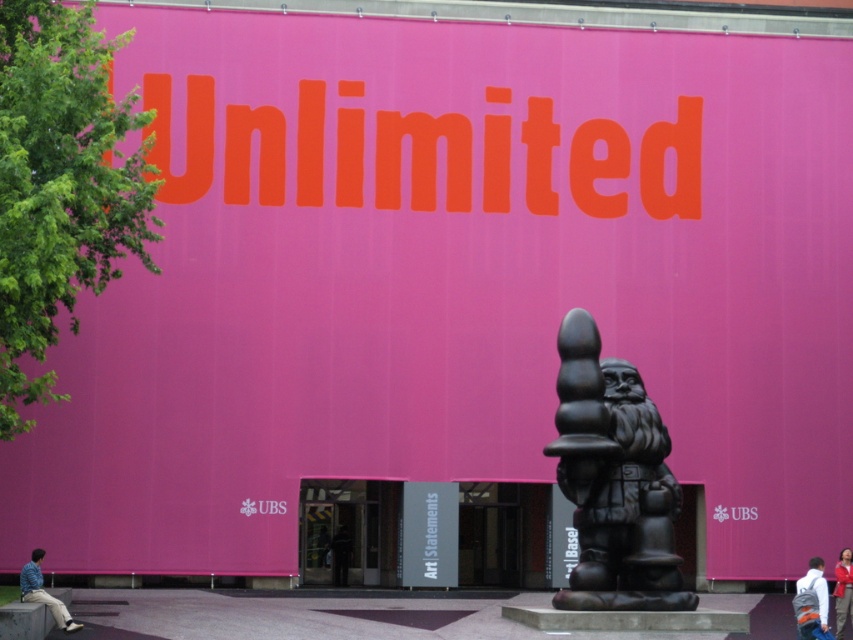
Question: Is black matte statue at center to the right of white fabric backpack at lower right from the viewer's perspective?

Choices:
 (A) yes
 (B) no

Answer: (B)

Question: Which of the following is the closest to the observer?

Choices:
 (A) (845, 556)
 (B) (47, 595)
 (C) (817, 566)

Answer: (C)

Question: Can you confirm if white fabric backpack at lower right is positioned below blue striped shirt at lower left?

Choices:
 (A) no
 (B) yes

Answer: (B)

Question: Which of the following is the farthest from the observer?

Choices:
 (A) (844, 547)
 (B) (631, 545)

Answer: (A)

Question: Which point is farther to the camera?

Choices:
 (A) (650, 506)
 (B) (834, 568)
 (C) (54, 596)

Answer: (C)

Question: Does white fabric backpack at lower right come in front of blue striped shirt at lower left?

Choices:
 (A) yes
 (B) no

Answer: (A)